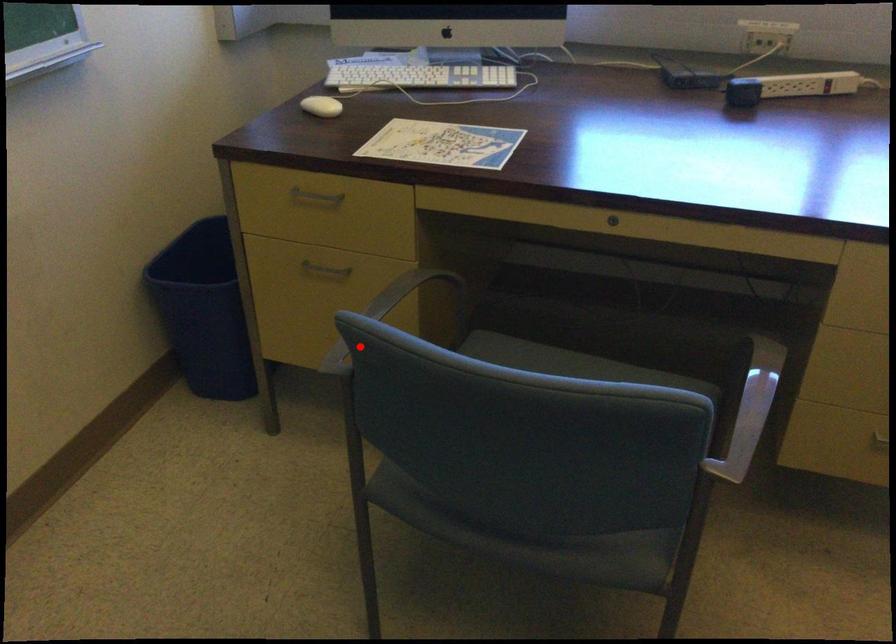
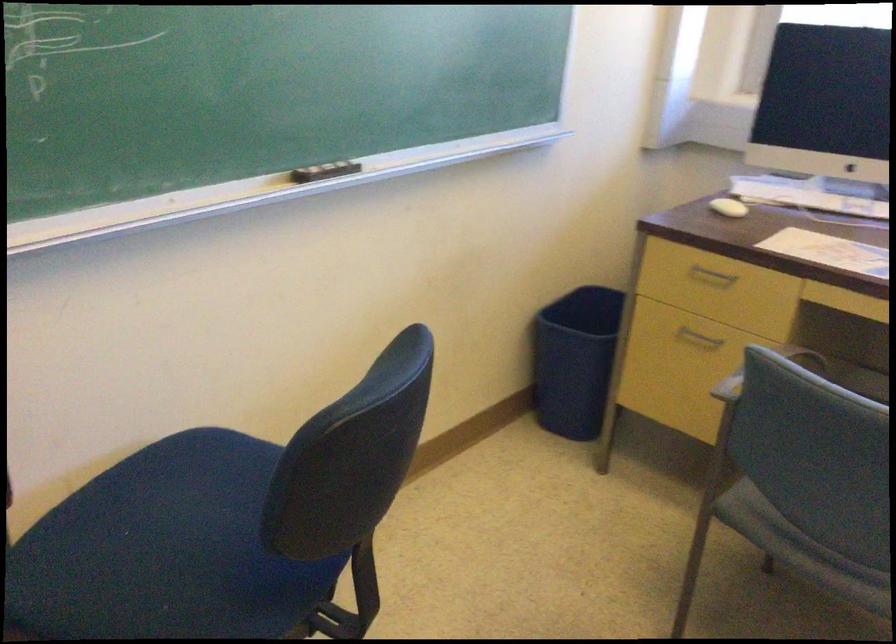
Question: I am providing you with two images of the same scene from different viewpoints. A red point is shown in image1. For the corresponding object point in image2, is it positioned nearer or farther from the camera?

Choices:
 (A) Nearer
 (B) Farther

Answer: (B)